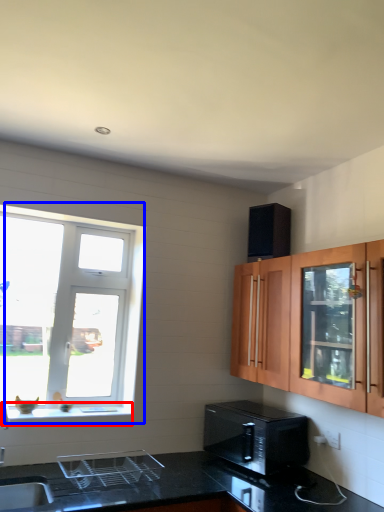
Question: Among these objects, which one is nearest to the camera, window sill (highlighted by a red box) or window (highlighted by a blue box)?

Choices:
 (A) window sill
 (B) window

Answer: (A)